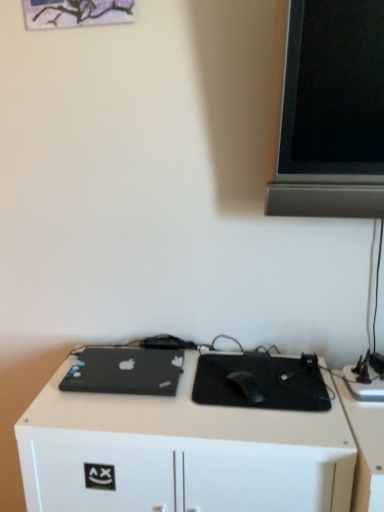
Image resolution: width=384 pixels, height=512 pixels. What do you see at coordinates (248, 386) in the screenshot?
I see `black matte mouse at center` at bounding box center [248, 386].

I want to click on black matte mouse at center, so click(x=248, y=386).

Who is smaller, white matte desk at center or black matte mousepad at center?

Smaller between the two is black matte mousepad at center.

Is black matte mousepad at center at the back of white matte desk at center?

No.

Can you confirm if white matte desk at center is wider than black matte mousepad at center?

Yes.

Locate an element on the screen. desk on the left of black matte mousepad at center is located at coordinates (180, 453).

Who is smaller, white matte desk at center or black matte mouse at center?

With smaller size is black matte mouse at center.

Is white matte desk at center in front of or behind black matte mouse at center in the image?

white matte desk at center is in front of black matte mouse at center.

From the image's perspective, is white matte desk at center over black matte mouse at center?

Incorrect, from the image's perspective, white matte desk at center is lower than black matte mouse at center.

Considering the sizes of objects white matte desk at center and black matte mouse at center in the image provided, who is wider, white matte desk at center or black matte mouse at center?

white matte desk at center.

Between black matte laptop at lower left and white matte desk at center, which one has larger width?

With larger width is white matte desk at center.

Is black matte laptop at lower left positioned behind white matte desk at center?

Yes, black matte laptop at lower left is further from the viewer.

From the picture: From the image's perspective, is black matte laptop at lower left positioned above or below white matte desk at center?

Clearly, from the image's perspective, black matte laptop at lower left is above white matte desk at center.

In the image, is black matte laptop at lower left on the left side or the right side of white matte desk at center?

Based on their positions, black matte laptop at lower left is located to the left of white matte desk at center.

Which is more to the right, black matte mouse at center or black matte mousepad at center?

black matte mousepad at center.

Which is closer, (248,391) or (265,365)?

Point (248,391).

I want to click on mouse above the black matte mousepad at center (from a real-world perspective), so click(x=248, y=386).

Does black matte mouse at center turn towards black matte mousepad at center?

No, black matte mouse at center does not turn towards black matte mousepad at center.

Considering the sizes of objects black matte mouse at center and black matte laptop at lower left in the image provided, who is bigger, black matte mouse at center or black matte laptop at lower left?

With larger size is black matte laptop at lower left.

Do you think black matte mouse at center is within black matte laptop at lower left, or outside of it?

black matte mouse at center exists outside the volume of black matte laptop at lower left.

Is black matte mouse at center facing towards black matte laptop at lower left?

No, black matte mouse at center is not aimed at black matte laptop at lower left.

The height and width of the screenshot is (512, 384). What are the coordinates of `laptop that appears above the black matte mouse at center (from the image's perspective)` in the screenshot? It's located at (124, 371).

From the image's perspective, between black matte mousepad at center and black matte mouse at center, who is located below?

From the image's view, black matte mousepad at center is below.

Image resolution: width=384 pixels, height=512 pixels. What are the coordinates of `mousepad located on the right of black matte mouse at center` in the screenshot? It's located at (259, 383).

Is the depth of black matte mousepad at center greater than that of black matte mouse at center?

No, black matte mousepad at center is in front of black matte mouse at center.

Is black matte mousepad at center thinner than black matte mouse at center?

In fact, black matte mousepad at center might be wider than black matte mouse at center.

Does black matte mousepad at center have a lesser width compared to black matte laptop at lower left?

Incorrect, the width of black matte mousepad at center is not less than that of black matte laptop at lower left.

I want to click on laptop lying on the left of black matte mousepad at center, so click(x=124, y=371).

Considering the relative sizes of black matte mousepad at center and black matte laptop at lower left in the image provided, is black matte mousepad at center smaller than black matte laptop at lower left?

Indeed, black matte mousepad at center has a smaller size compared to black matte laptop at lower left.

Which is correct: black matte mousepad at center is inside black matte laptop at lower left, or outside of it?

black matte mousepad at center lies outside black matte laptop at lower left.

Where is `desk below the black matte mousepad at center (from a real-world perspective)`? This screenshot has width=384, height=512. desk below the black matte mousepad at center (from a real-world perspective) is located at coordinates (180, 453).

Where is `mouse on the right side of white matte desk at center`? mouse on the right side of white matte desk at center is located at coordinates (248, 386).

From the picture: Based on their spatial positions, is black matte laptop at lower left or black matte mouse at center closer to black matte mousepad at center?

Based on the image, black matte mouse at center appears to be nearer to black matte mousepad at center.

From the image, which object appears to be farther from black matte laptop at lower left, black matte mousepad at center or black matte mouse at center?

Among the two, black matte mouse at center is located further to black matte laptop at lower left.

Based on their spatial positions, is black matte mouse at center or black matte mousepad at center closer to black matte laptop at lower left?

black matte mousepad at center is closer to black matte laptop at lower left.

Which object lies further to the anchor point black matte mouse at center, black matte laptop at lower left or black matte mousepad at center?

Among the two, black matte laptop at lower left is located further to black matte mouse at center.

Considering their positions, is black matte mouse at center positioned closer to black matte laptop at lower left than white matte desk at center?

white matte desk at center.

Looking at the image, which one is located closer to black matte mousepad at center, white matte desk at center or black matte laptop at lower left?

white matte desk at center.

Based on their spatial positions, is black matte mouse at center or black matte laptop at lower left closer to black matte mousepad at center?

Based on the image, black matte mouse at center appears to be nearer to black matte mousepad at center.

Estimate the real-world distances between objects in this image. Which object is further from white matte desk at center, black matte laptop at lower left or black matte mousepad at center?

black matte mousepad at center.

Find the location of a particular element. The height and width of the screenshot is (512, 384). mousepad between black matte mouse at center and white matte desk at center vertically is located at coordinates (259, 383).

Where is `mouse between black matte laptop at lower left and white matte desk at center in the up-down direction`? This screenshot has width=384, height=512. mouse between black matte laptop at lower left and white matte desk at center in the up-down direction is located at coordinates (248, 386).

Where is `mousepad between black matte laptop at lower left and white matte desk at center in the up-down direction`? mousepad between black matte laptop at lower left and white matte desk at center in the up-down direction is located at coordinates (259, 383).

Where is `mouse between black matte laptop at lower left and black matte mousepad at center`? mouse between black matte laptop at lower left and black matte mousepad at center is located at coordinates (248, 386).